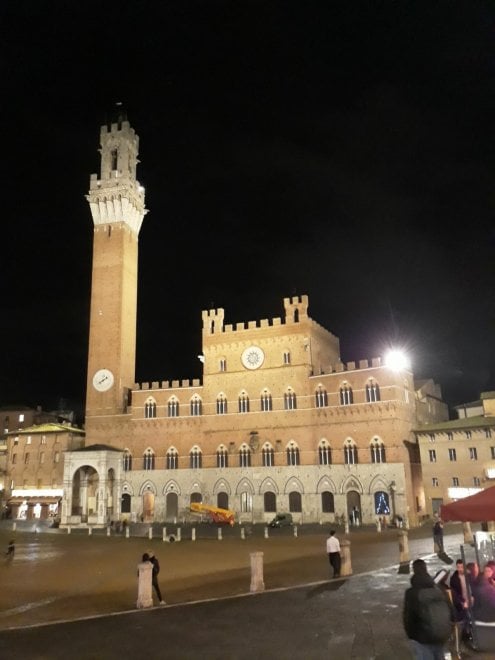
You are a GUI agent. You are given a task and a screenshot of the screen. Output one action in this format:
    pyautogui.click(x=<x>, y=<y>)
    Task: Click on the clock
    
    Given the screenshot: What is the action you would take?
    pyautogui.click(x=103, y=381)